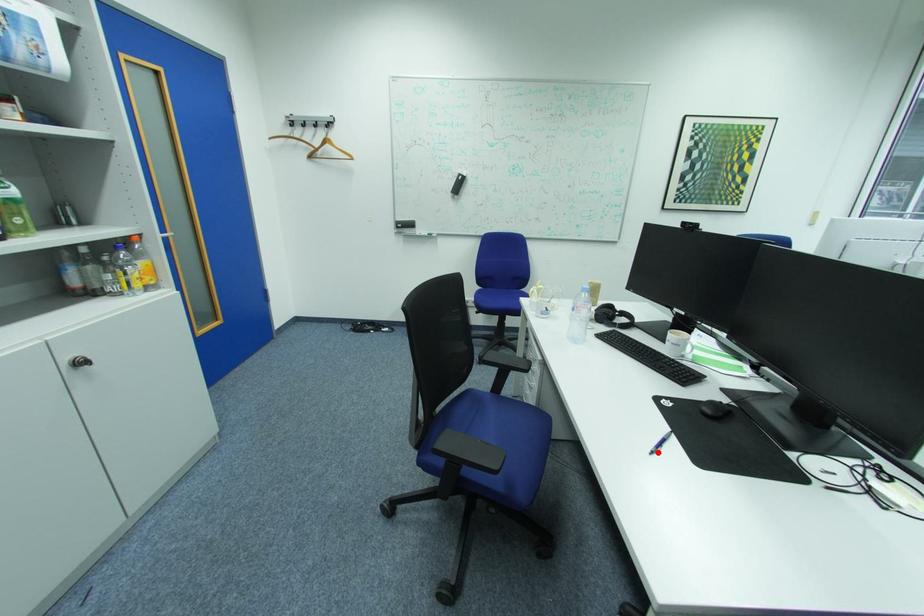
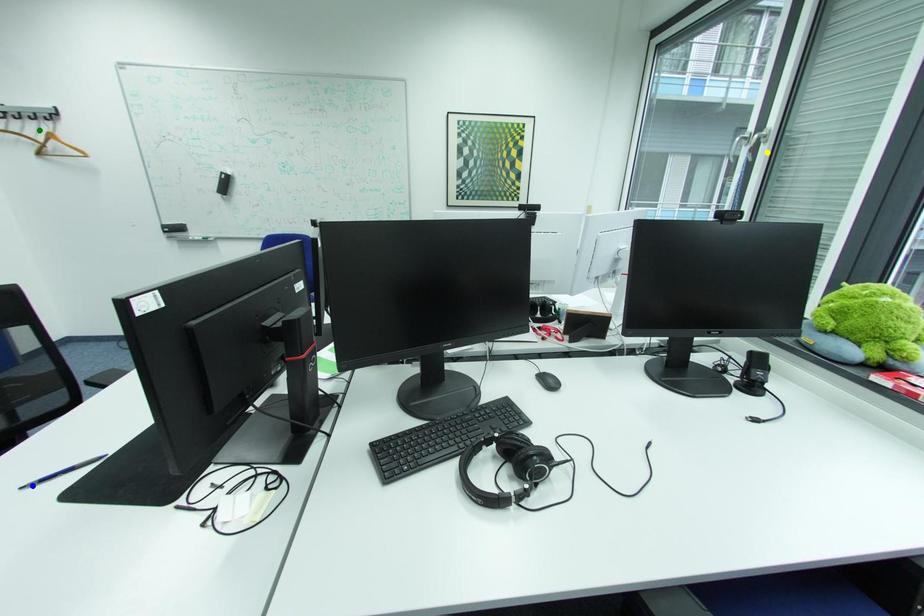
Question: I am providing you with two images of the same scene from different viewpoints. A red point is marked on the first image. You are given multiple points on the second image. Which spot in image 2 lines up with the point in image 1?

Choices:
 (A) green point
 (B) blue point
 (C) yellow point

Answer: (B)